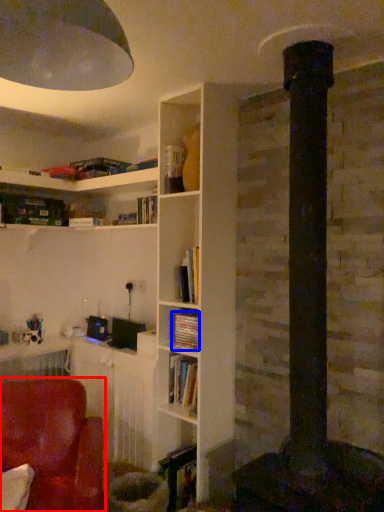
Question: Among these objects, which one is nearest to the camera, chair (highlighted by a red box) or book (highlighted by a blue box)?

Choices:
 (A) chair
 (B) book

Answer: (A)